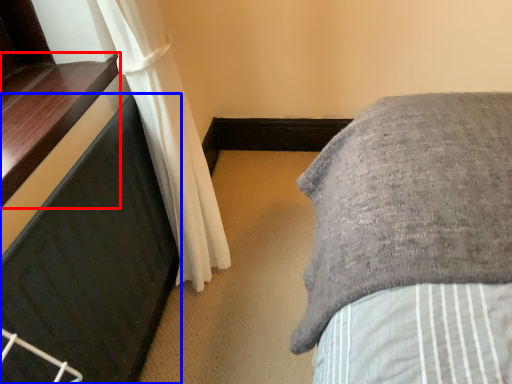
Question: Among these objects, which one is farthest to the camera, window sill (highlighted by a red box) or furniture (highlighted by a blue box)?

Choices:
 (A) window sill
 (B) furniture

Answer: (A)